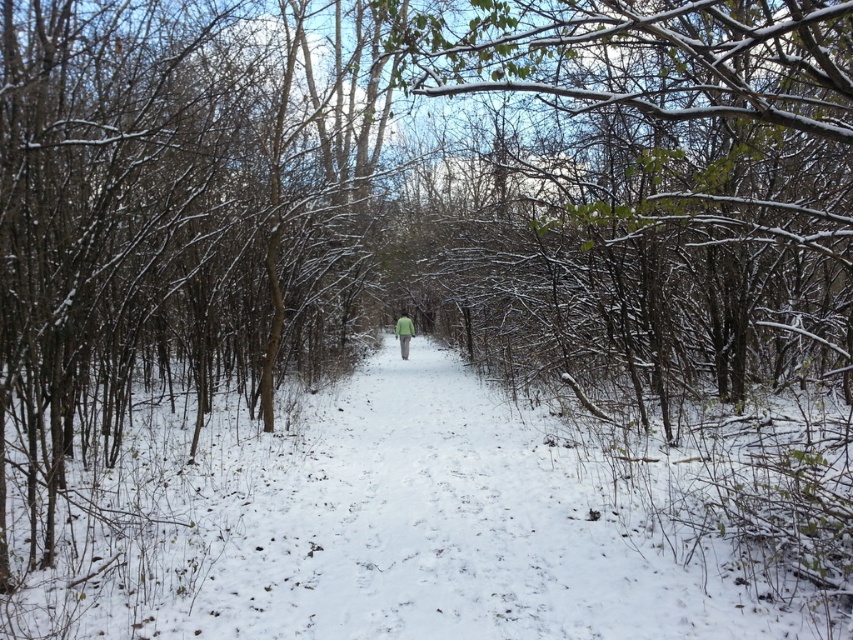
Question: Can you confirm if white powdery snow at center is thinner than snow-covered branches at center?

Choices:
 (A) no
 (B) yes

Answer: (A)

Question: Does white powdery snow at center lie in front of green matte jacket at center?

Choices:
 (A) yes
 (B) no

Answer: (A)

Question: Considering the real-world distances, which object is closest to the green matte jacket at center?

Choices:
 (A) white powdery snow at center
 (B) snow-covered branches at center

Answer: (A)

Question: Which of the following is the farthest from the observer?

Choices:
 (A) (402, 312)
 (B) (840, 186)

Answer: (A)

Question: Considering the real-world distances, which object is closest to the snow-covered branches at center?

Choices:
 (A) white powdery snow at center
 (B) green matte jacket at center

Answer: (A)

Question: Can you confirm if snow-covered branches at center is positioned below green matte jacket at center?

Choices:
 (A) yes
 (B) no

Answer: (B)